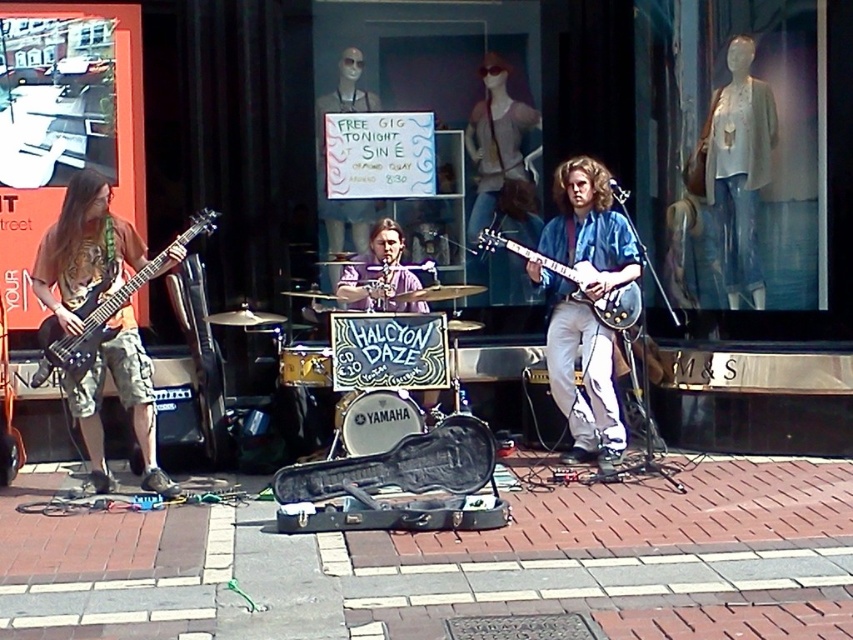
Is matte black guitar at left wider than blue glossy guitar at center?

Yes, matte black guitar at left is wider than blue glossy guitar at center.

Who is lower down, matte black guitar at left or blue glossy guitar at center?

matte black guitar at left is lower down.

Locate an element on the screen. matte black guitar at left is located at coordinates tap(83, 250).

Between point (728, 496) and point (735, 115), which one is positioned behind?

Positioned behind is point (735, 115).

This screenshot has width=853, height=640. In order to click on brick pavement at center in this screenshot , I will do click(451, 560).

Identify the location of brick pavement at center. (451, 560).

Is brick pavement at center further to camera compared to matte black guitar at left?

No, it is in front of matte black guitar at left.

Does brick pavement at center have a lesser height compared to matte black guitar at left?

Indeed, brick pavement at center has a lesser height compared to matte black guitar at left.

Find the location of a particular element. brick pavement at center is located at coordinates (451, 560).